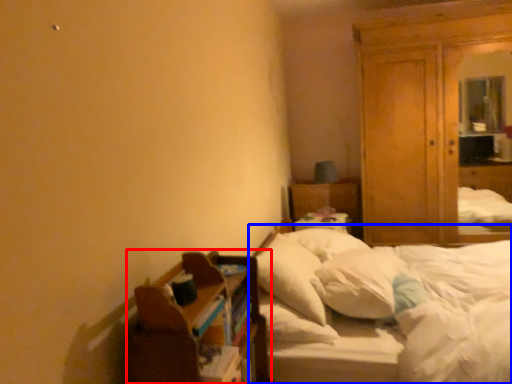
Question: Which object is closer to the camera taking this photo, shelf (highlighted by a red box) or bed (highlighted by a blue box)?

Choices:
 (A) shelf
 (B) bed

Answer: (A)